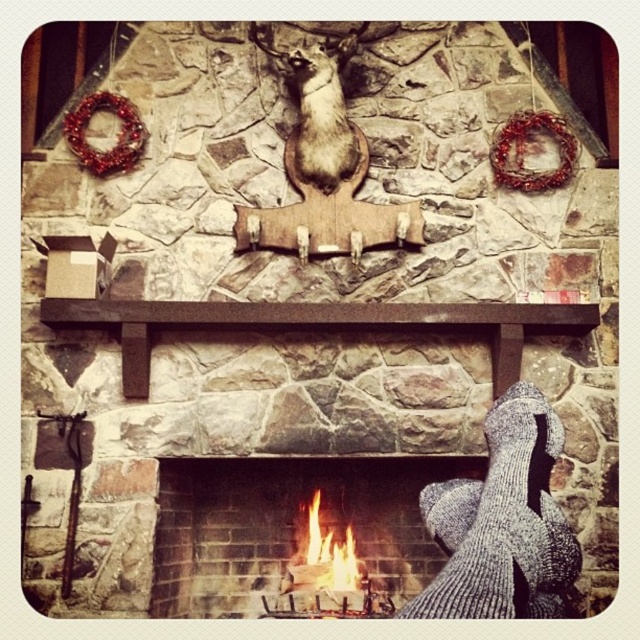
You are a guest at this cozy fireplace scene. You see a fuzzy brown ferret at center and flamewooden logs at lower center. Which object is taller?

The fuzzy brown ferret at center is taller than the flamewooden logs at lower center.

You are sitting on a couch facing the brick fireplace at center and the flamewooden logs at lower center. Which object is closer to you?

The brick fireplace at center is closer to you than the flamewooden logs at lower center.

You are a pet owner who wants to ensure your fuzzy brown ferret at center has enough space to move freely. The ferret requires a minimum of 1 meter between itself and any heat source like the flamewooden logs at lower center. Is the current distance sufficient?

The fuzzy brown ferret at center and the flamewooden logs at lower center are 1.11 meters apart, which exceeds the required 1 meter minimum distance. Therefore, the current distance is sufficient for the ferret to move safely.